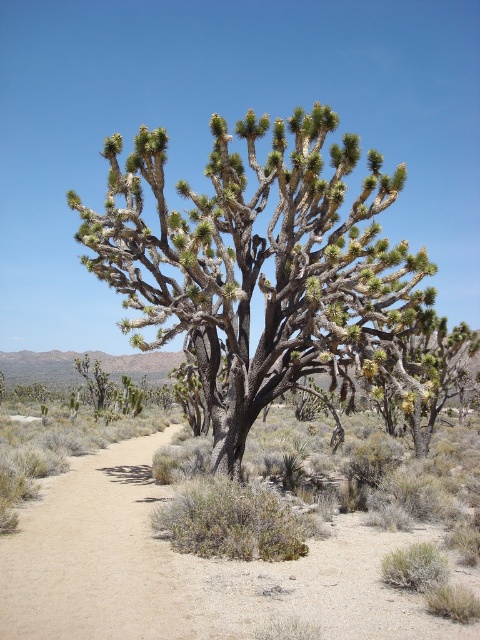
Question: Can you confirm if green spiny joshua tree at center is positioned to the left of brown sandy dirt track at center?

Choices:
 (A) yes
 (B) no

Answer: (B)

Question: Among these points, which one is farthest from the camera?

Choices:
 (A) (326, 580)
 (B) (205, 248)
 (C) (21, 580)

Answer: (B)

Question: Does green spiny joshua tree at center have a larger size compared to brown sandy dirt track at center?

Choices:
 (A) no
 (B) yes

Answer: (B)

Question: Observing the image, what is the correct spatial positioning of green spiny joshua tree at center in reference to brown sandy dirt track at center?

Choices:
 (A) right
 (B) left

Answer: (A)

Question: Which point is farther to the camera?

Choices:
 (A) (131, 515)
 (B) (52, 605)
 (C) (132, 209)

Answer: (C)

Question: Among these points, which one is farthest from the camera?

Choices:
 (A) (387, 625)
 (B) (346, 380)

Answer: (B)